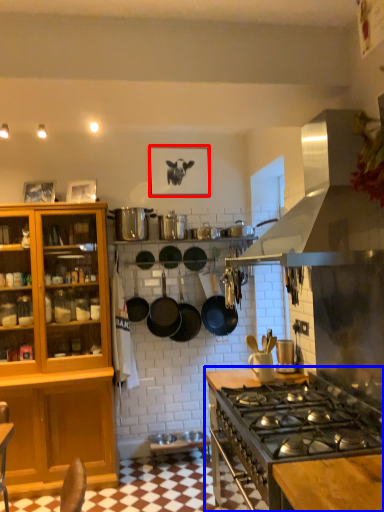
Question: Which object appears farthest to the camera in this image, picture frame (highlighted by a red box) or countertop (highlighted by a blue box)?

Choices:
 (A) picture frame
 (B) countertop

Answer: (A)